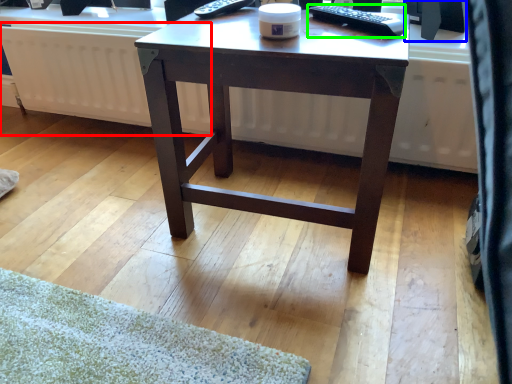
Question: Which object is the farthest from radiator (highlighted by a red box)? Choose among these: computer monitor (highlighted by a blue box) or remote control (highlighted by a green box).

Choices:
 (A) computer monitor
 (B) remote control

Answer: (A)